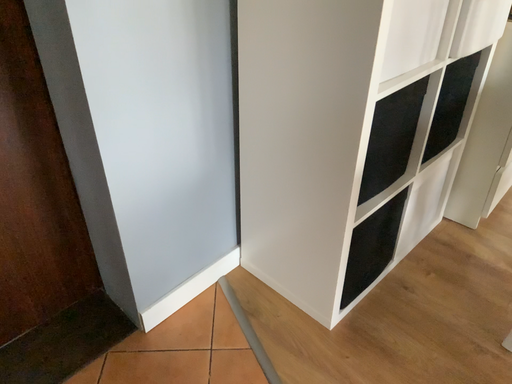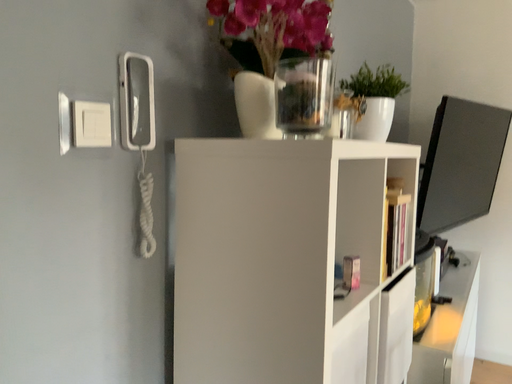
Question: How did the camera likely rotate when shooting the video?

Choices:
 (A) rotated left
 (B) rotated right

Answer: (B)